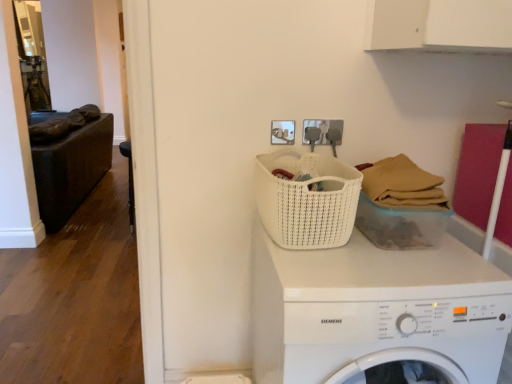
Question: From the image's perspective, relative to black leather chair at left, is white plastic washing machine at center above or below?

Choices:
 (A) above
 (B) below

Answer: (B)

Question: Considering the positions of white plastic washing machine at center and black leather chair at left in the image, is white plastic washing machine at center taller or shorter than black leather chair at left?

Choices:
 (A) short
 (B) tall

Answer: (B)

Question: Based on their relative distances, which object is farther from the white plastic washing machine at center?

Choices:
 (A) black leather chair at left
 (B) white woven basket at center, which is the second basket in left-to-right order
 (C) white woven basket at center, placed as the first basket when sorted from left to right

Answer: (A)

Question: Based on their relative distances, which object is nearer to the black leather chair at left?

Choices:
 (A) white woven basket at center, which is the second basket in left-to-right order
 (B) white woven basket at center, placed as the first basket when sorted from left to right
 (C) white plastic washing machine at center

Answer: (B)